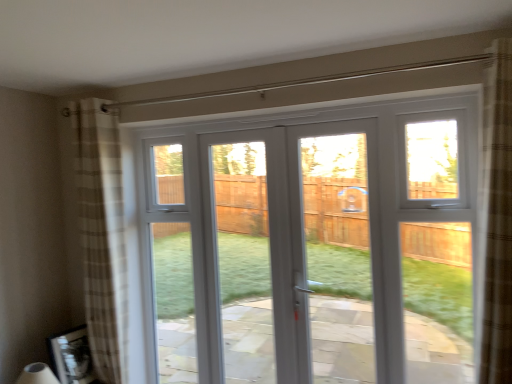
Locate an element on the screen. plaid fabric curtain at left is located at coordinates (101, 234).

Describe the element at coordinates (312, 245) in the screenshot. I see `white plastic window at center` at that location.

Identify the location of white plastic door at center. (291, 252).

This screenshot has width=512, height=384. What do you see at coordinates (291, 252) in the screenshot?
I see `white plastic door at center` at bounding box center [291, 252].

Where is `plaid fabric curtain at left`? The image size is (512, 384). plaid fabric curtain at left is located at coordinates (101, 234).

From the image's perspective, which one is positioned lower, white plastic window at center or plaid fabric curtain at left?

white plastic window at center.

Considering the relative positions of white plastic window at center and plaid fabric curtain at left in the image provided, is white plastic window at center behind plaid fabric curtain at left?

No.

Considering the relative sizes of white plastic window at center and plaid fabric curtain at left in the image provided, is white plastic window at center smaller than plaid fabric curtain at left?

Incorrect, white plastic window at center is not smaller in size than plaid fabric curtain at left.

How different are the orientations of white plastic window at center and plaid fabric curtain at left in degrees?

0.402 degrees.

Consider the image. Is white plastic door at center in front of or behind plaid fabric curtain at left in the image?

In the image, white plastic door at center appears in front of plaid fabric curtain at left.

Is white plastic door at center to the left or to the right of plaid fabric curtain at left in the image?

Clearly, white plastic door at center is on the right of plaid fabric curtain at left in the image.

Is white plastic door at center outside of plaid fabric curtain at left?

white plastic door at center is positioned outside plaid fabric curtain at left.

Is plaid fabric curtain at left positioned with its back to white plastic window at center?

That's not correct — plaid fabric curtain at left is not looking away from white plastic window at center.

From the image's perspective, is plaid fabric curtain at left over white plastic window at center?

Yes.

Looking at this image, are plaid fabric curtain at left and white plastic window at center located far from each other?

plaid fabric curtain at left is near white plastic window at center, not far away.

Between point (84, 163) and point (379, 305), which one is positioned behind?

Positioned behind is point (84, 163).

From a real-world perspective, is plaid fabric curtain at left positioned above or below white plastic door at center?

In terms of real-world spatial position, plaid fabric curtain at left is above white plastic door at center.

Looking at this image, is plaid fabric curtain at left positioned with its back to white plastic door at center?

plaid fabric curtain at left does not have its back to white plastic door at center.

From the image's perspective, which one is positioned lower, plaid fabric curtain at left or white plastic door at center?

white plastic door at center, from the image's perspective.

Is plaid fabric curtain at left with white plastic door at center?

plaid fabric curtain at left and white plastic door at center are not in contact.

From the image's perspective, which one is positioned lower, white plastic window at center or white plastic door at center?

From the image's view, white plastic window at center is below.

Is white plastic window at center not near white plastic door at center?

Indeed, white plastic window at center is not near white plastic door at center.

From the picture: Is white plastic window at center positioned in front of white plastic door at center?

Yes, the depth of white plastic window at center is less than that of white plastic door at center.

Is white plastic window at center at the right side of white plastic door at center?

No.

Is white plastic door at center aimed at white plastic window at center?

Yes.

From the image's perspective, is white plastic door at center positioned above or below white plastic window at center?

white plastic door at center is above white plastic window at center.

Considering the positions of objects white plastic door at center and white plastic window at center in the image provided, who is behind, white plastic door at center or white plastic window at center?

white plastic door at center.

How different are the orientations of white plastic door at center and white plastic window at center in degrees?

The facing directions of white plastic door at center and white plastic window at center are 1.81 degrees apart.

Identify the location of window below the plaid fabric curtain at left (from a real-world perspective). This screenshot has width=512, height=384. (312, 245).

Locate an element on the screen. Image resolution: width=512 pixels, height=384 pixels. curtain behind the white plastic door at center is located at coordinates (101, 234).

From the picture: Considering their positions, is plaid fabric curtain at left positioned further to white plastic door at center than white plastic window at center?

The object further to white plastic door at center is plaid fabric curtain at left.

Estimate the real-world distances between objects in this image. Which object is further from plaid fabric curtain at left, white plastic window at center or white plastic door at center?

Among the two, white plastic door at center is located further to plaid fabric curtain at left.

Considering their positions, is white plastic window at center positioned further to white plastic door at center than plaid fabric curtain at left?

plaid fabric curtain at left is positioned further to the anchor white plastic door at center.

Which object lies nearer to the anchor point plaid fabric curtain at left, white plastic door at center or white plastic window at center?

white plastic window at center is closer to plaid fabric curtain at left.

Based on their spatial positions, is white plastic door at center or plaid fabric curtain at left closer to white plastic window at center?

The object closer to white plastic window at center is plaid fabric curtain at left.

Estimate the real-world distances between objects in this image. Which object is closer to white plastic window at center, plaid fabric curtain at left or white plastic door at center?

Among the two, plaid fabric curtain at left is located nearer to white plastic window at center.

Locate an element on the screen. This screenshot has height=384, width=512. window between plaid fabric curtain at left and white plastic door at center from left to right is located at coordinates (312, 245).